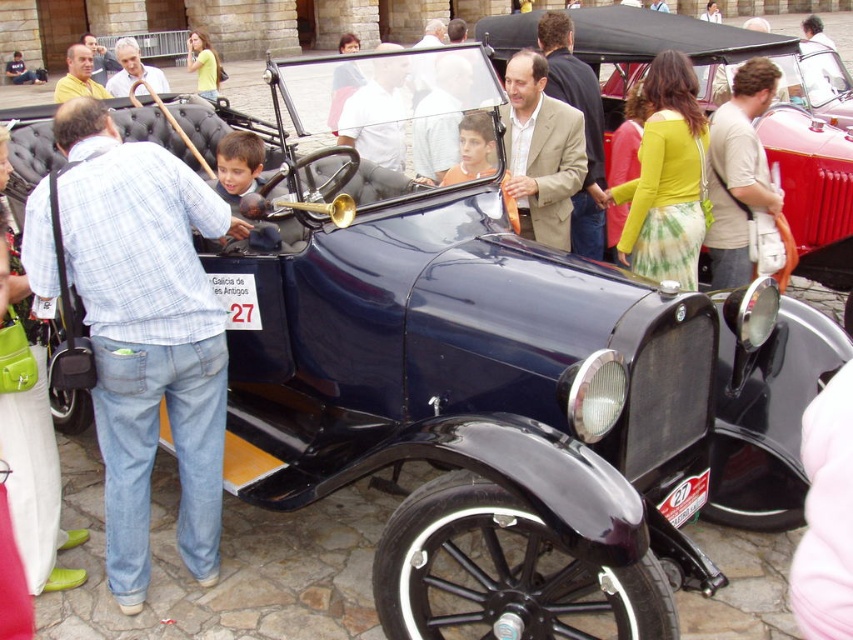
Does light brown suit at center come in front of matte brown jacket at center?

No, light brown suit at center is further to the viewer.

What do you see at coordinates (584, 129) in the screenshot?
I see `light brown suit at center` at bounding box center [584, 129].

Does point (577, 68) come behind point (428, 97)?

Yes.

Where is `light brown suit at center`? The width and height of the screenshot is (853, 640). light brown suit at center is located at coordinates (584, 129).

Looking at this image, which is above, light brown suit at center or matte gray shirt at center?

matte gray shirt at center

This screenshot has width=853, height=640. In order to click on light brown suit at center in this screenshot , I will do `click(584, 129)`.

What are the coordinates of `light brown suit at center` in the screenshot? It's located at (584, 129).

Measure the distance between light brown leather bag at center and camera.

light brown leather bag at center is 32.82 feet from camera.

Is point (741, 84) farther from camera compared to point (213, 76)?

No, (741, 84) is closer to viewer.

Is point (751, 192) more distant than point (189, 70)?

No, it is not.

This screenshot has height=640, width=853. What are the coordinates of `light brown leather bag at center` in the screenshot? It's located at (738, 173).